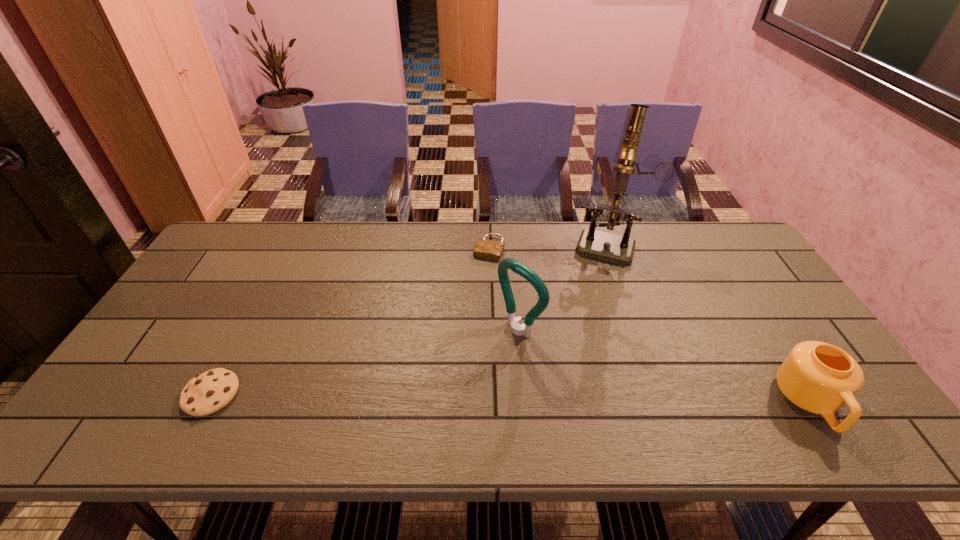
Identify the location of free space that is in between the fourth object from left to right and the bottle opener. (564, 286).

Identify the location of vacant region between the third nearest object and the third tallest object. The image size is (960, 540). (664, 366).

In order to click on vacant point located between the cookie and the second tallest object in this screenshot , I will do `click(366, 362)`.

Where is `empty space between the padlock and the microscope`? Image resolution: width=960 pixels, height=540 pixels. empty space between the padlock and the microscope is located at coordinates (549, 246).

Identify the location of vacant area that lies between the padlock and the second object from right to left. Image resolution: width=960 pixels, height=540 pixels. (549, 246).

The height and width of the screenshot is (540, 960). In order to click on free space between the mug and the shortest object in this screenshot , I will do `click(649, 326)`.

Where is `free space that is in between the cookie and the padlock`? Image resolution: width=960 pixels, height=540 pixels. free space that is in between the cookie and the padlock is located at coordinates (350, 321).

You are a GUI agent. You are given a task and a screenshot of the screen. Output one action in this format:
    pyautogui.click(x=<x>, y=<y>)
    Task: Click on the vacant area between the mug and the third nearest object
    This screenshot has height=540, width=960.
    Given the screenshot: What is the action you would take?
    pyautogui.click(x=664, y=366)

Image resolution: width=960 pixels, height=540 pixels. What are the coordinates of `object that stands as the second closest to the bottle opener` in the screenshot? It's located at (612, 247).

Find the location of a particular element. object that is the fourth closest to the mug is located at coordinates coord(209,392).